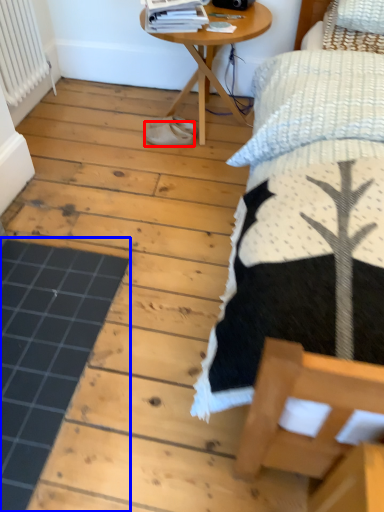
Question: Which object appears farthest to the camera in this image, footwear (highlighted by a red box) or plank (highlighted by a blue box)?

Choices:
 (A) footwear
 (B) plank

Answer: (A)